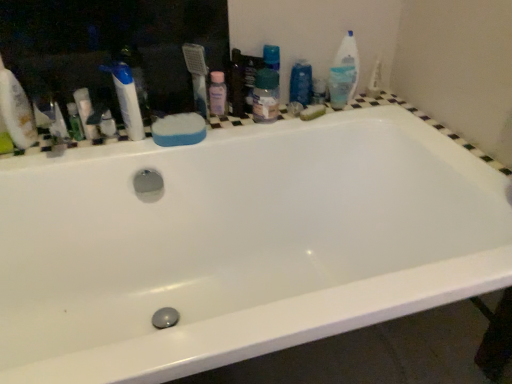
Question: Is white glossy toothpaste at upper left at the back of green sponge at upper right, which appears as the first soap when viewed from the right?

Choices:
 (A) yes
 (B) no

Answer: (B)

Question: Considering the relative sizes of green sponge at upper right, which appears as the first soap when viewed from the right, and white glossy toothpaste at upper left in the image provided, is green sponge at upper right, which appears as the first soap when viewed from the right, smaller than white glossy toothpaste at upper left?

Choices:
 (A) yes
 (B) no

Answer: (A)

Question: From the image's perspective, is green sponge at upper right, which appears as the first soap when viewed from the back, under white glossy toothpaste at upper left?

Choices:
 (A) yes
 (B) no

Answer: (B)

Question: Does green sponge at upper right, which appears as the first soap when viewed from the right, have a greater height compared to white glossy toothpaste at upper left?

Choices:
 (A) yes
 (B) no

Answer: (B)

Question: Is green sponge at upper right, which appears as the first soap when viewed from the back, beside white glossy toothpaste at upper left?

Choices:
 (A) yes
 (B) no

Answer: (B)

Question: Is green sponge at upper right, the 2th soap positioned from the front, shorter than white glossy toothpaste at upper left?

Choices:
 (A) yes
 (B) no

Answer: (A)

Question: From a real-world perspective, is white plastic toothbrush at upper left, the fifth toiletry from the right, under pink plastic bottle at upper center, placed as the fourth toiletry when sorted from right to left?

Choices:
 (A) yes
 (B) no

Answer: (A)

Question: Is white plastic toothbrush at upper left, the first toiletry when ordered from left to right, to the left of pink plastic bottle at upper center, arranged as the second toiletry when viewed from the left, from the viewer's perspective?

Choices:
 (A) yes
 (B) no

Answer: (A)

Question: Is white plastic toothbrush at upper left, the first toiletry when ordered from left to right, at the right side of pink plastic bottle at upper center, arranged as the second toiletry when viewed from the left?

Choices:
 (A) no
 (B) yes

Answer: (A)

Question: Is white plastic toothbrush at upper left, the first toiletry when ordered from left to right, positioned with its back to pink plastic bottle at upper center, placed as the fourth toiletry when sorted from right to left?

Choices:
 (A) yes
 (B) no

Answer: (B)

Question: Considering the relative sizes of white plastic toothbrush at upper left, the first toiletry when ordered from left to right, and pink plastic bottle at upper center, arranged as the second toiletry when viewed from the left, in the image provided, is white plastic toothbrush at upper left, the first toiletry when ordered from left to right, smaller than pink plastic bottle at upper center, arranged as the second toiletry when viewed from the left,?

Choices:
 (A) yes
 (B) no

Answer: (B)

Question: Can you confirm if white plastic toothbrush at upper left, the first toiletry when ordered from left to right, is bigger than pink plastic bottle at upper center, arranged as the second toiletry when viewed from the left?

Choices:
 (A) yes
 (B) no

Answer: (A)

Question: Is green plastic mouthwash at left positioned beyond the bounds of white plastic medicine cabinet at upper left?

Choices:
 (A) yes
 (B) no

Answer: (A)